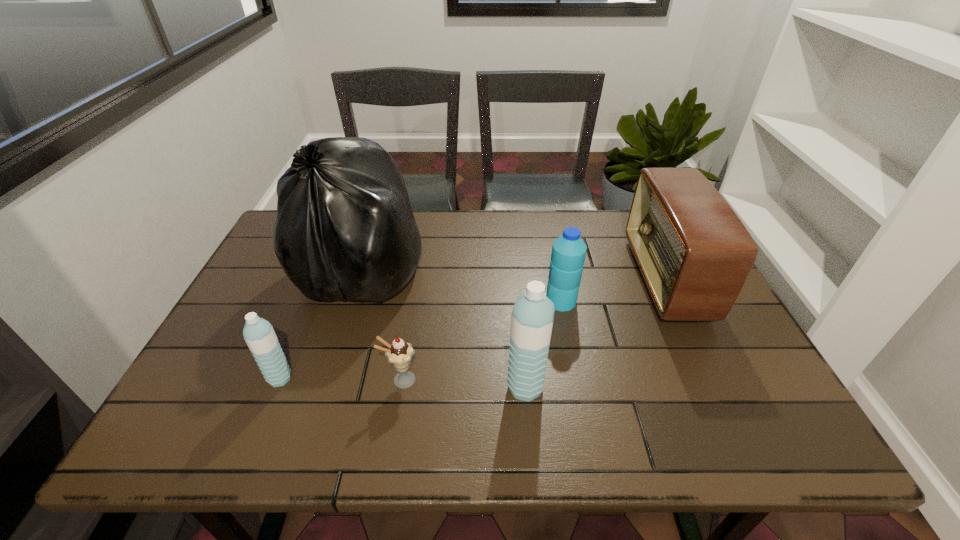
This screenshot has height=540, width=960. What are the coordinates of `free location located 0.170m on the back of the rightmost water bottle` in the screenshot? It's located at (x=551, y=252).

At what (x,y) coordinates should I click in order to perform the action: click on free location located on the front-facing side of the radio receiver. Please return your answer as a coordinate pair (x, y). The height and width of the screenshot is (540, 960). Looking at the image, I should click on (561, 279).

Identify the location of free space located on the front-facing side of the radio receiver. (586, 279).

Locate an element on the screen. This screenshot has height=540, width=960. free region located on the front-facing side of the radio receiver is located at coordinates (596, 279).

The width and height of the screenshot is (960, 540). In order to click on free point located on the right of the plastic bag in this screenshot , I will do `click(475, 266)`.

Where is `blank space located on the left of the shortest object`? Image resolution: width=960 pixels, height=540 pixels. blank space located on the left of the shortest object is located at coordinates (218, 380).

Locate an element on the screen. radio receiver that is at the far edge is located at coordinates (695, 254).

Locate an element on the screen. The height and width of the screenshot is (540, 960). plastic bag that is positioned at the far edge is located at coordinates (345, 229).

Identify the location of icecream that is positioned at the near edge. (399, 353).

Identify the location of object present at the left edge. (345, 229).